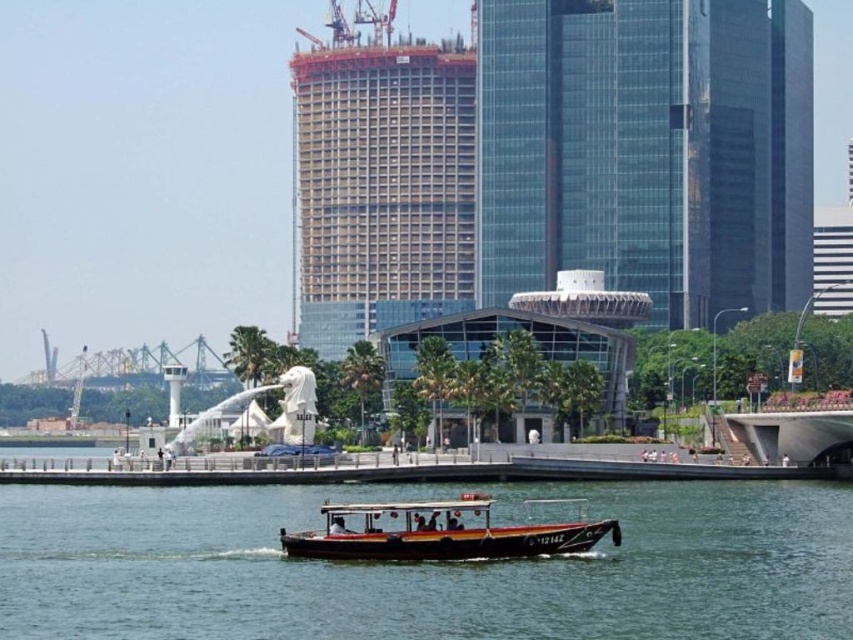
Does green water at center have a greater height compared to transparent glass skyscraper at center?

In fact, green water at center may be shorter than transparent glass skyscraper at center.

Does green water at center appear on the right side of transparent glass skyscraper at center?

No, green water at center is not to the right of transparent glass skyscraper at center.

What do you see at coordinates (424, 566) in the screenshot?
I see `green water at center` at bounding box center [424, 566].

Locate an element on the screen. green water at center is located at coordinates (424, 566).

Between point (677, 557) and point (322, 547), which one is positioned in front?

Positioned in front is point (322, 547).

Is green water at center to the right of wooden polished boat at center from the viewer's perspective?

Incorrect, green water at center is not on the right side of wooden polished boat at center.

Which is behind, point (15, 554) or point (561, 544)?

The point (15, 554) is behind.

Identify the location of green water at center. (424, 566).

Is transparent glass skyscraper at center above concrete frame building at center?

→ Actually, transparent glass skyscraper at center is below concrete frame building at center.

Who is positioned more to the left, transparent glass skyscraper at center or concrete frame building at center?

From the viewer's perspective, concrete frame building at center appears more on the left side.

Find the location of a particular element. The image size is (853, 640). transparent glass skyscraper at center is located at coordinates (647, 148).